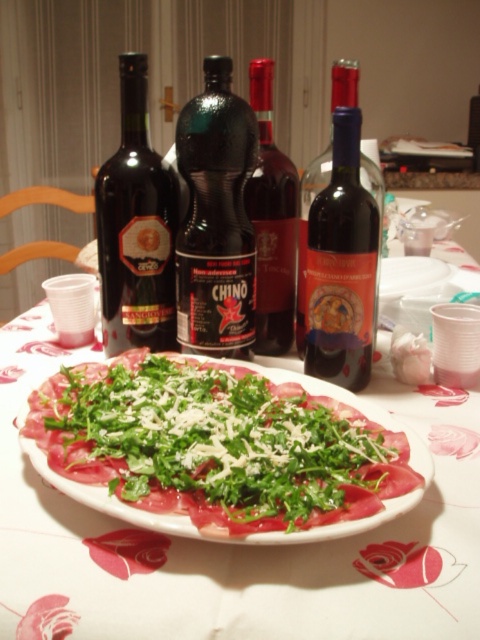
Describe the element at coordinates (342, 252) in the screenshot. I see `dark glass wine bottle at center` at that location.

The image size is (480, 640). Find the location of `dark glass wine bottle at center`. dark glass wine bottle at center is located at coordinates (342, 252).

Identify the location of dark glass wine bottle at center. The width and height of the screenshot is (480, 640). (342, 252).

Is point (257, 422) farther from viewer compared to point (349, 372)?

No, (257, 422) is in front of (349, 372).

Can you confirm if green leafymaterial/texture at center is positioned above dark glass wine bottle at center?

Incorrect, green leafymaterial/texture at center is not positioned above dark glass wine bottle at center.

Does point (193, 461) lie behind point (354, 253)?

No, it is in front of (354, 253).

I want to click on green leafymaterial/texture at center, so [222, 449].

Find the location of `black glass bottle at center`. black glass bottle at center is located at coordinates (216, 218).

Is black glass bottle at center to the left of dark glass wine bottle at center from the viewer's perspective?

Correct, you'll find black glass bottle at center to the left of dark glass wine bottle at center.

This screenshot has height=640, width=480. I want to click on black glass bottle at center, so click(216, 218).

Identify the location of black glass bottle at center. (216, 218).